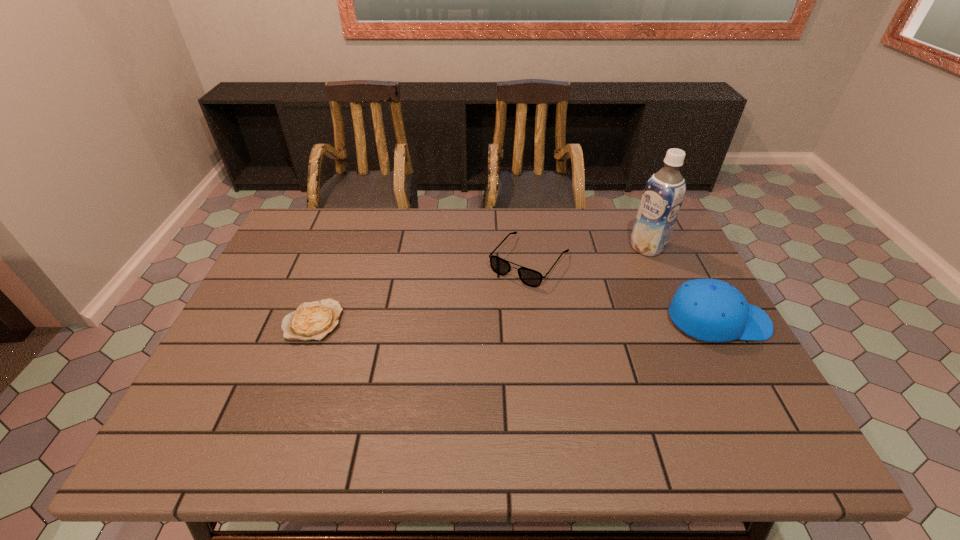
Where is `vacant spot on the desktop that is between the leftmost object and the cap and is positioned on the front-facing side of the second shortest object`? The width and height of the screenshot is (960, 540). vacant spot on the desktop that is between the leftmost object and the cap and is positioned on the front-facing side of the second shortest object is located at coordinates (481, 321).

I want to click on free space on the desktop that is between the leftmost object and the cap and is positioned on the label of the tallest object, so click(x=522, y=321).